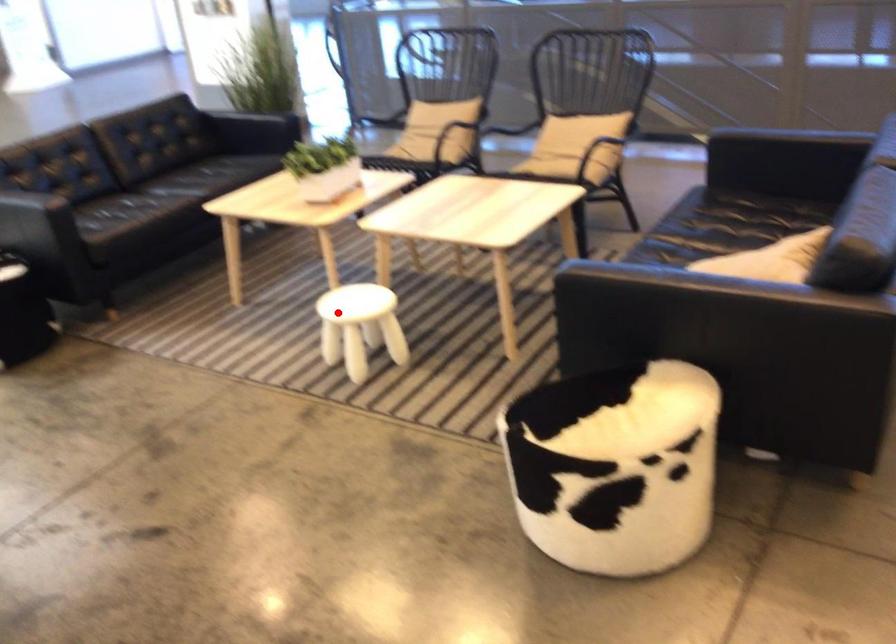
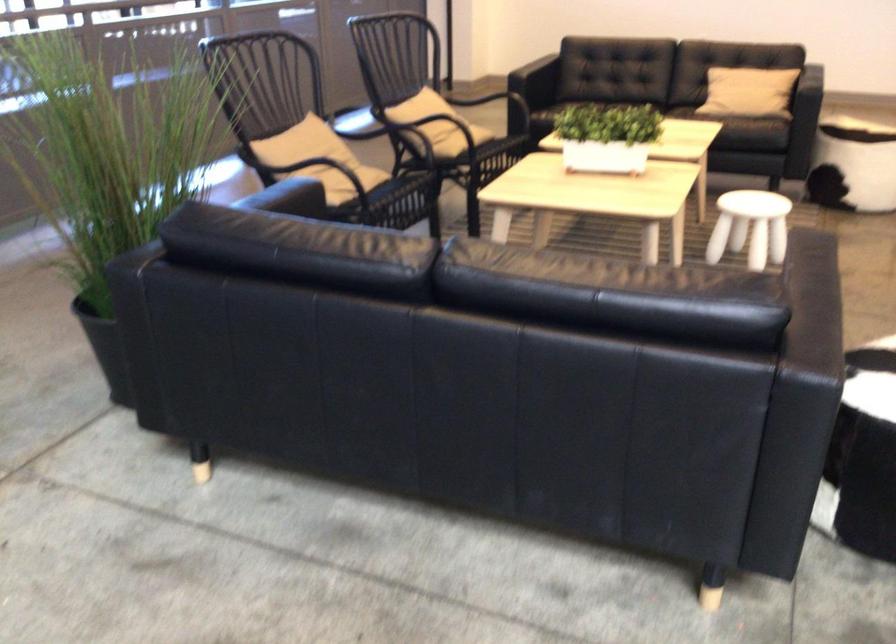
Locate, in the second image, the point that corresponds to the highlighted location in the first image.

(750, 227)